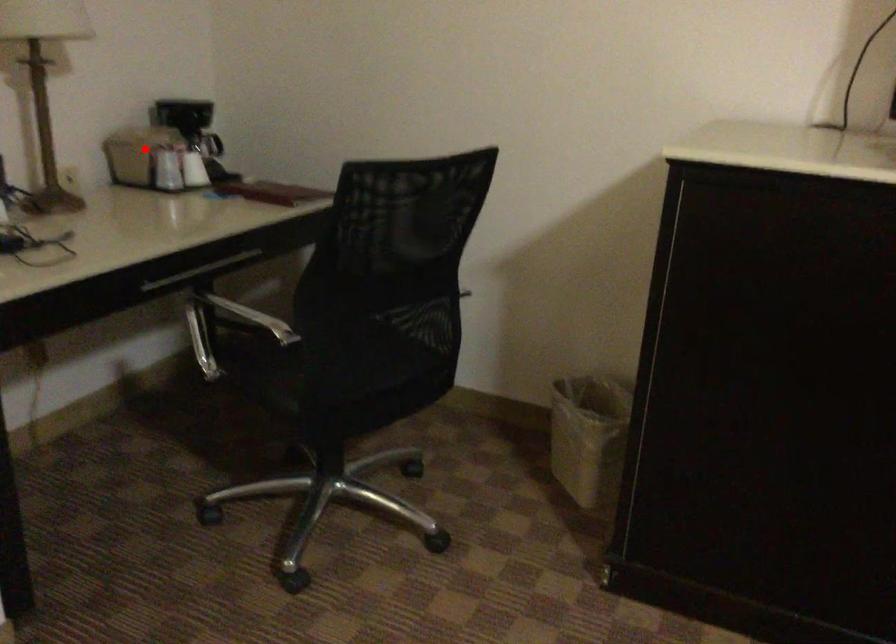
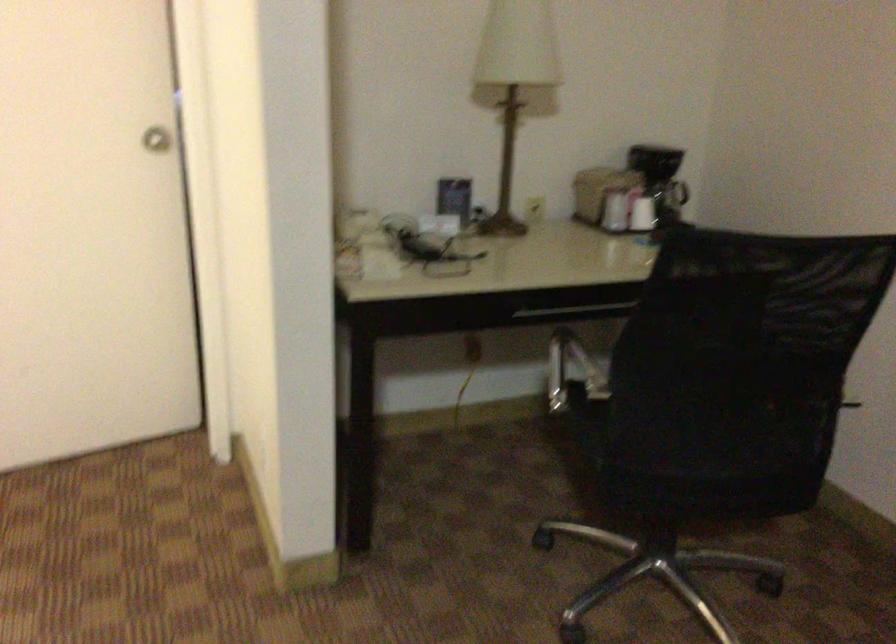
In the second image, find the point that corresponds to the highlighted location in the first image.

(599, 190)